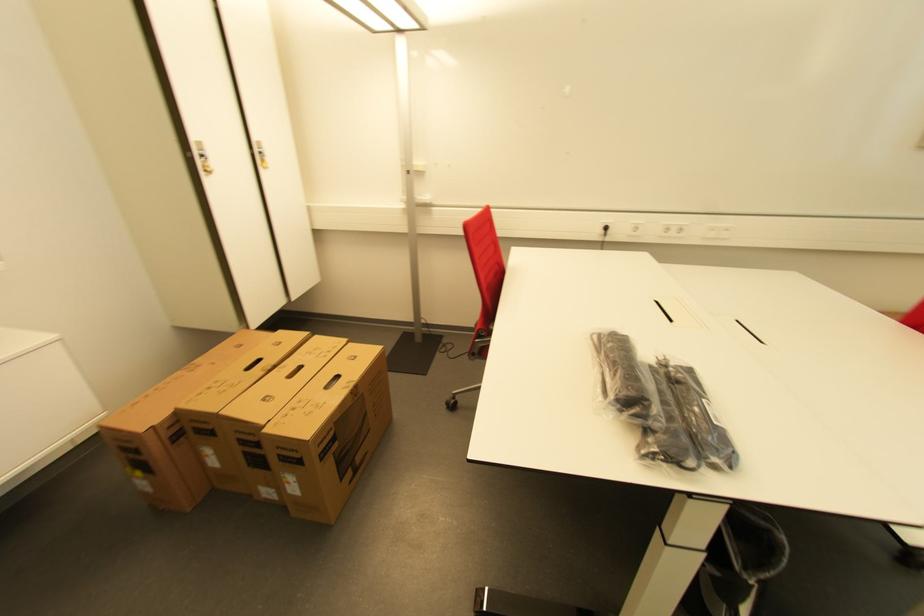
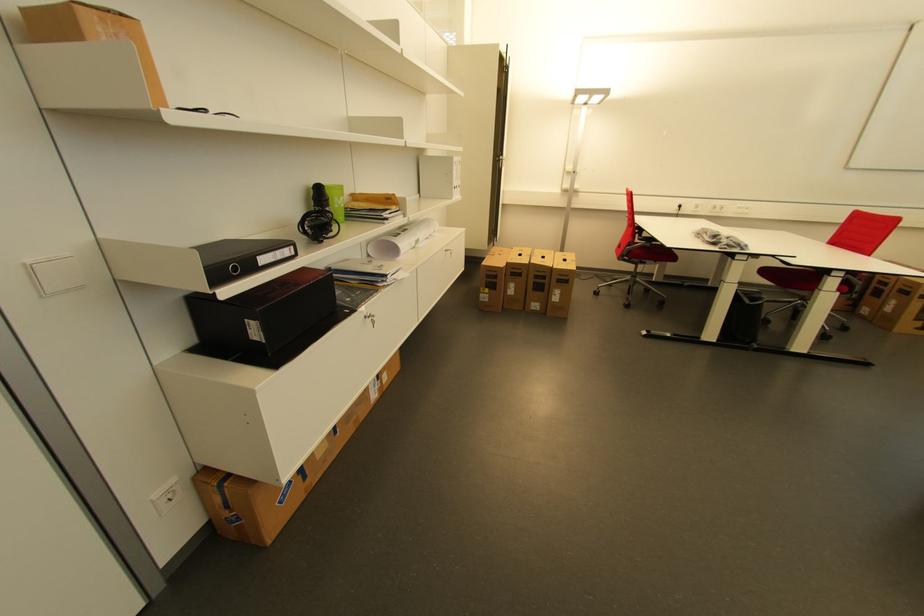
The point at (262, 446) is marked in the first image. Where is the corresponding point in the second image?

(550, 278)